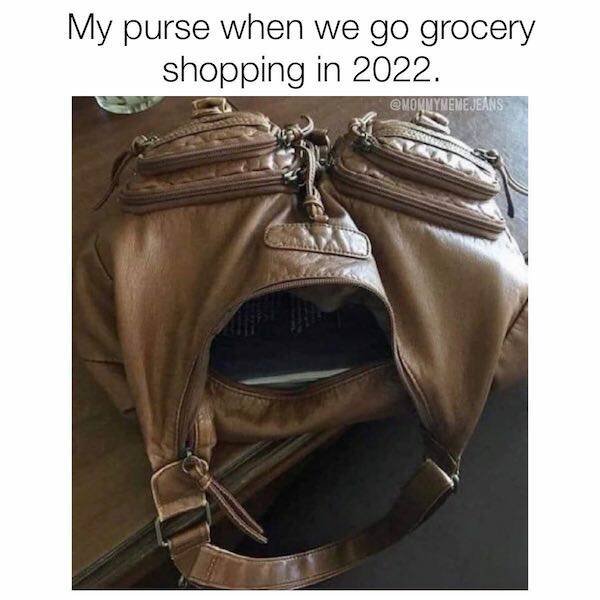
In order to click on book in this screenshot , I will do `click(306, 347)`.